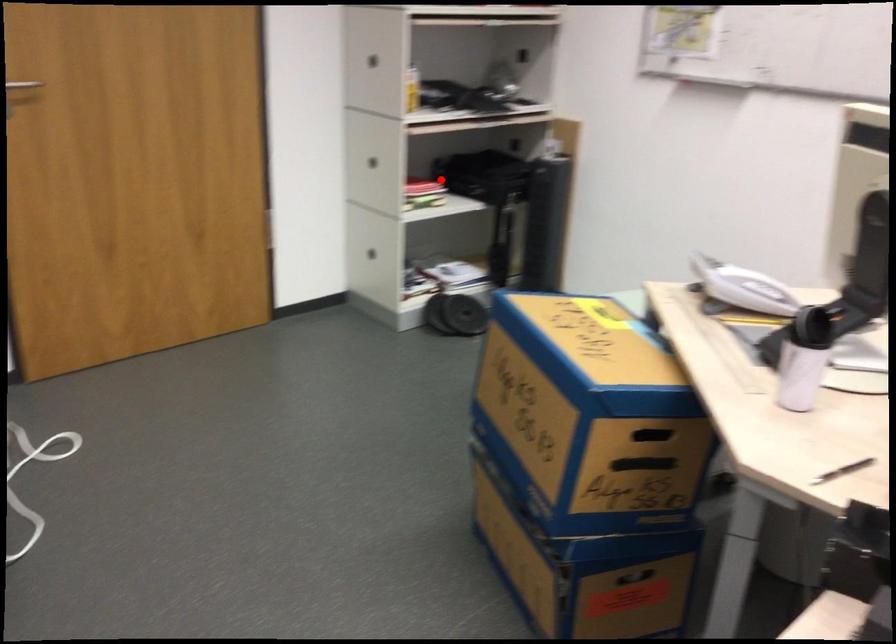
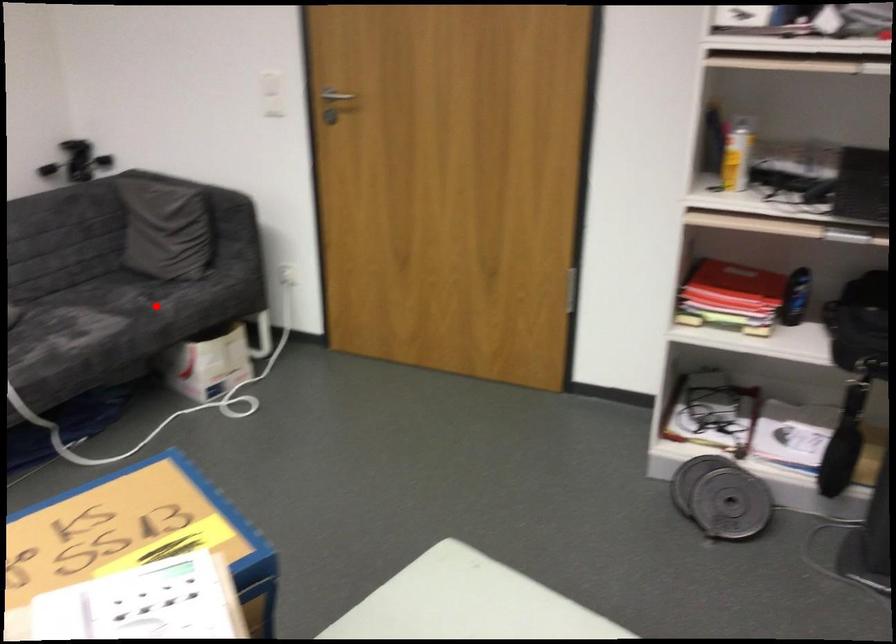
I am providing you with two images of the same scene from different viewpoints. A red point is marked on the first image and another point is marked on the second image. Does the point marked in image1 correspond to the same location as the one in image2?

No